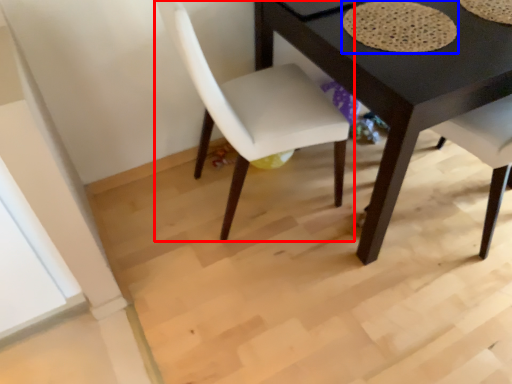
Question: Which of the following is the farthest to the observer, chair (highlighted by a red box) or mat (highlighted by a blue box)?

Choices:
 (A) chair
 (B) mat

Answer: (B)